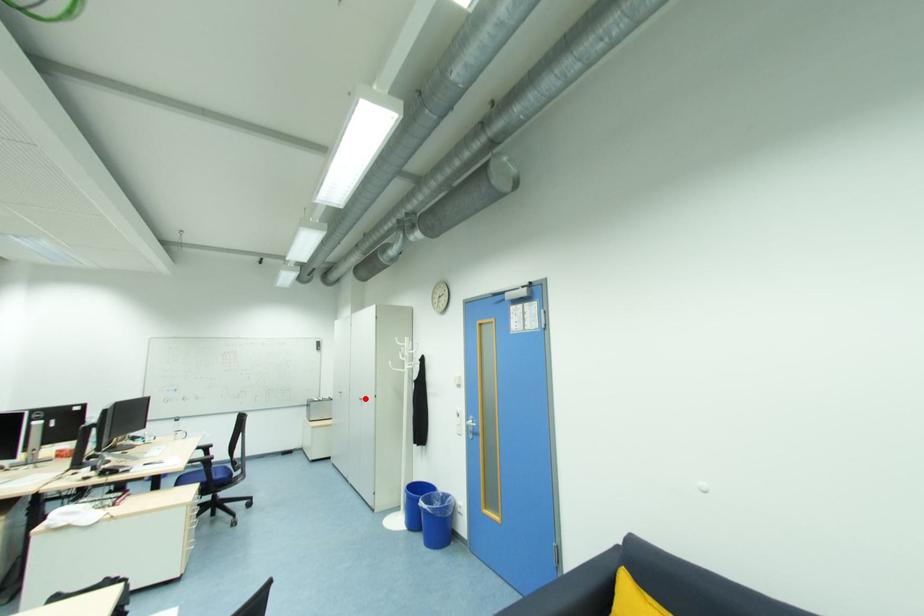
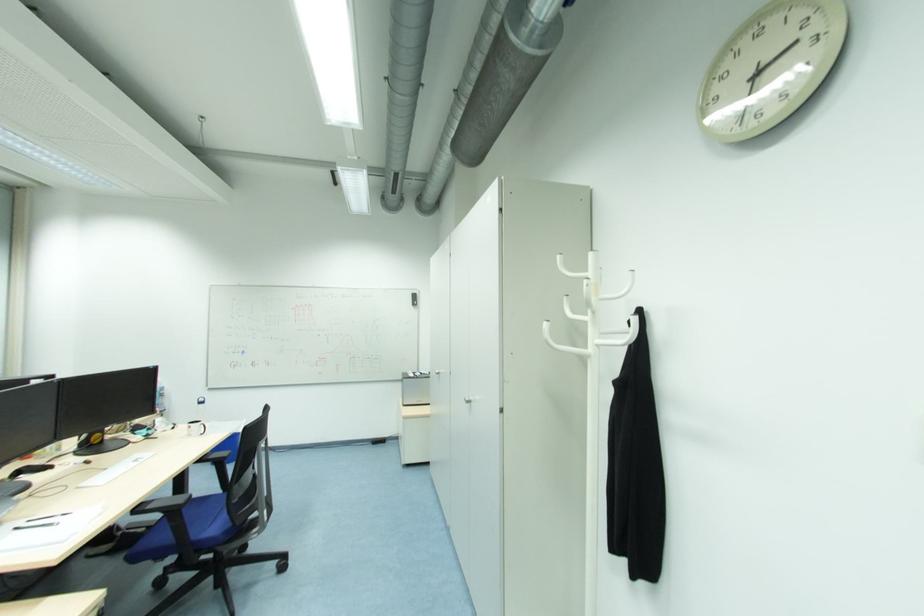
Where in the second image is the point corresponding to the highlighted location from the first image?

(473, 400)